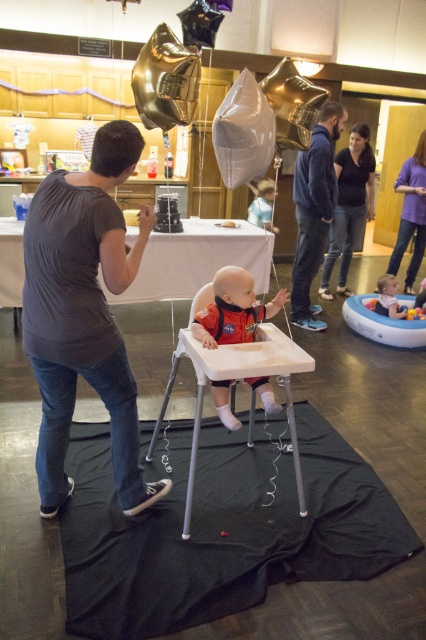
You are a photographer at the birthday party and want to take a photo of the gold metallic balloon at upper center and the purple fabric shirt at upper right. Which object is positioned closer to the camera?

The gold metallic balloon at upper center is closer to the viewer than the purple fabric shirt at upper right, so it will appear closer in the photo.

Consider the image. You are a photographer at the birthday party. You need to take a closeup photo of the matte red bibbed baby at center and the white plastic highchair at center. Can you fit both in the frame if your camera has a minimum focus distance of 6 inches?

The distance between the white plastic highchair at center and the matte red bibbed baby at center is 5.88 inches, which is less than the camera minimum focus distance of 6 inches. Therefore, the photographer can fit both in the frame.

You are at a birthday party and see a baby in a red NASA outfit sitting in a white high chair. There is a point marked at coordinates (166,81). What object is this point located on?

The point marked at coordinates (166,81) is located on the gold metallic balloon at upper center.